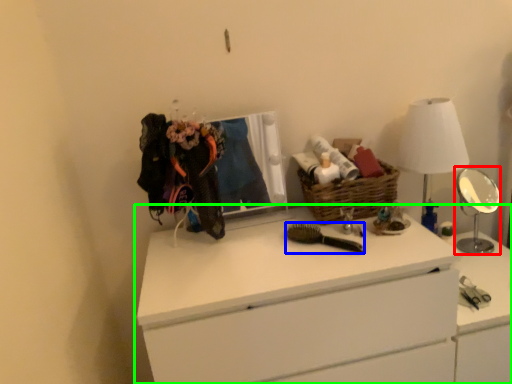
Question: Based on their relative distances, which object is nearer to mirror (highlighted by a red box)? Choose from brush (highlighted by a blue box) and chest of drawers (highlighted by a green box).

Choices:
 (A) brush
 (B) chest of drawers

Answer: (B)